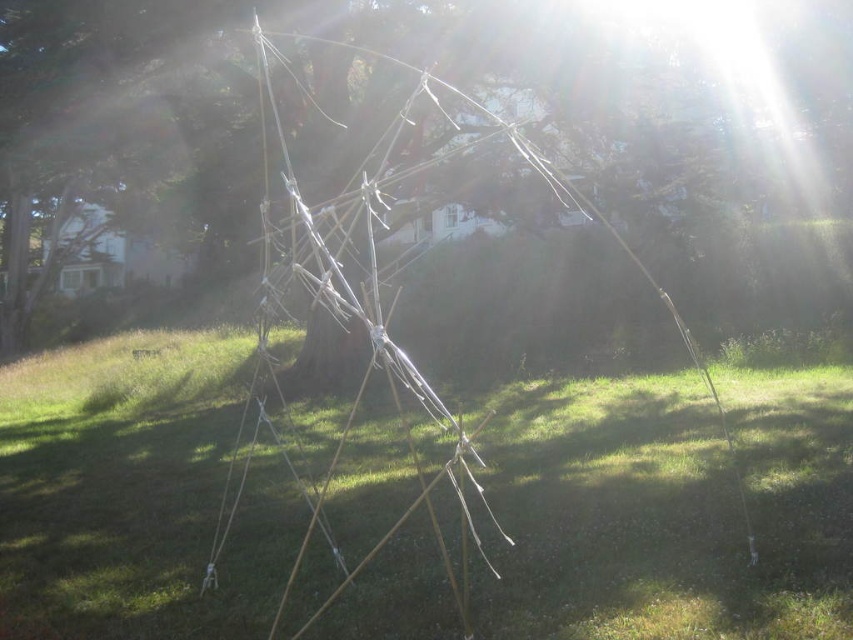
Is green grass at center to the right of white stringy structure at center from the viewer's perspective?

No, green grass at center is not to the right of white stringy structure at center.

How distant is green grass at center from white stringy structure at center?

3.06 meters

Locate an element on the screen. Image resolution: width=853 pixels, height=640 pixels. green grass at center is located at coordinates (669, 508).

The width and height of the screenshot is (853, 640). Find the location of `green grass at center`. green grass at center is located at coordinates (669, 508).